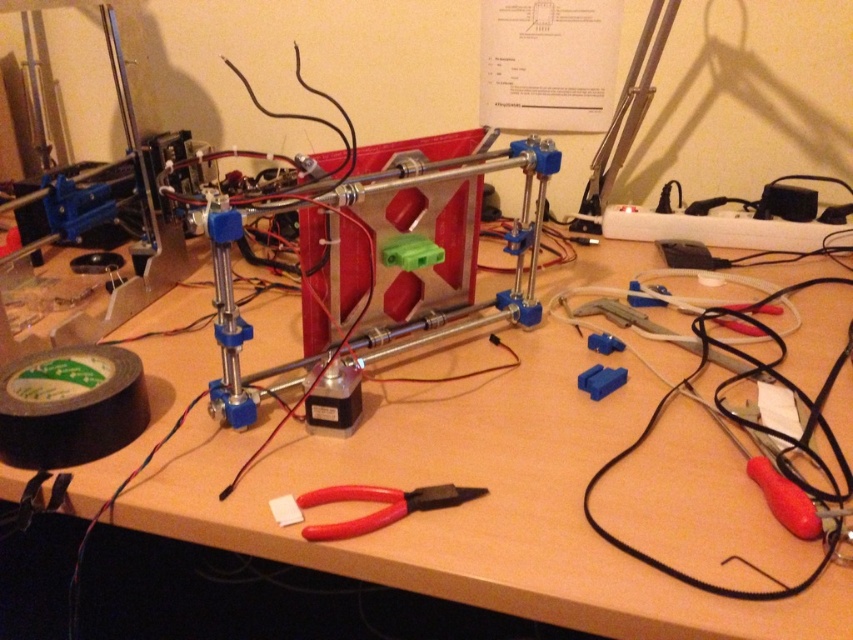
You are a technician working on the wooden table at center. You need to place a heavy tool on the table without disturbing the red plastic pliers at center. Where should you place it?

Place the heavy tool on the wooden table at center away from the red plastic pliers at center to avoid disturbing them, since the wooden table at center is above the red plastic pliers at center.

You are a technician working on the wooden table at center. You need to place the red plastic pliers at center on the table. Will the pliers fit on the table without hanging off the edge?

The wooden table at center is taller than red plastic pliers at center, so the pliers will fit on the table without hanging off the edge since the table is higher than the pliers.